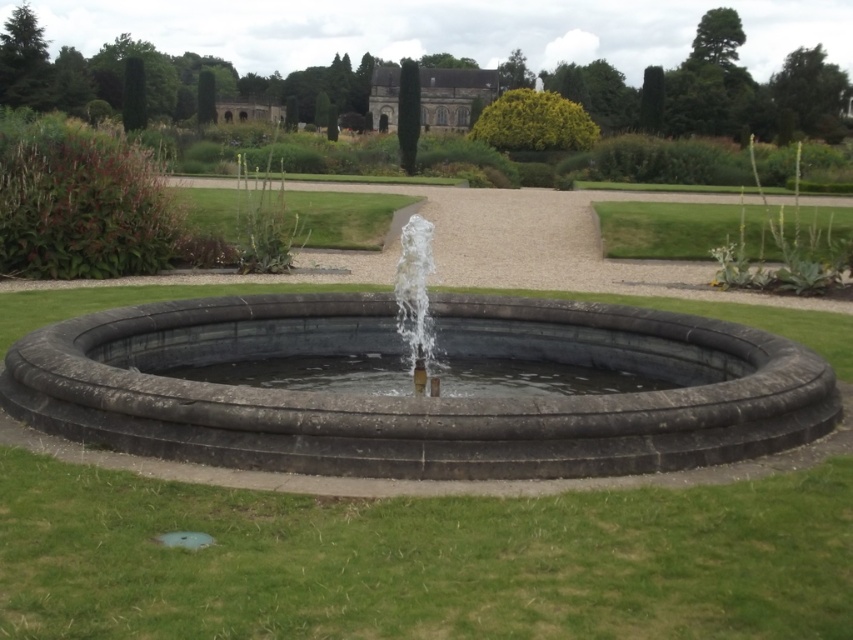
You are standing in the garden and want to take a photo of the dark gray stone fountain at center and the clear stone water at center. Which object should you focus on first if you want both to be in sharp focus?

The dark gray stone fountain at center is in front of clear stone water at center, so you should focus on the dark gray stone fountain at center first to ensure both are in sharp focus.

You are standing at the entrance of the garden and want to locate the dark gray stone fountain at center. According to the garden layout, where would you find it?

The dark gray stone fountain at center is located at point (419, 397) in the garden layout.